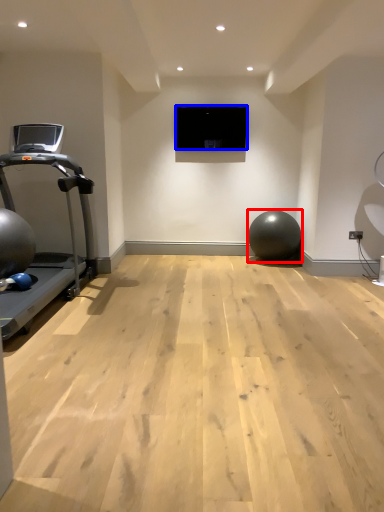
Question: Which object appears farthest to the camera in this image, ball (highlighted by a red box) or projection screen (highlighted by a blue box)?

Choices:
 (A) ball
 (B) projection screen

Answer: (B)